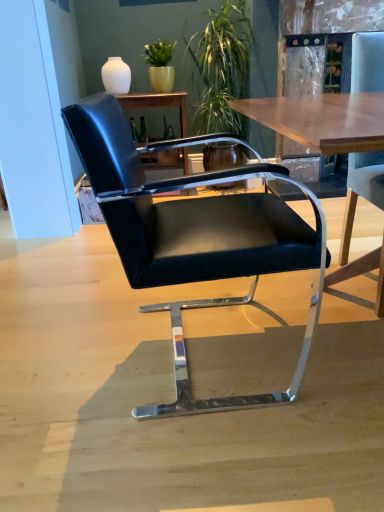
Question: Would you say black leather chair at center, the 1th chair in the left-to-right sequence, contains matte black chair at center?

Choices:
 (A) yes
 (B) no

Answer: (B)

Question: Is black leather chair at center, the 1th chair in the left-to-right sequence, not near matte black chair at center?

Choices:
 (A) no
 (B) yes

Answer: (B)

Question: From a real-world perspective, is black leather chair at center, the second chair viewed from the right, on matte black chair at center?

Choices:
 (A) no
 (B) yes

Answer: (A)

Question: From the image's perspective, does black leather chair at center, the second chair viewed from the right, appear lower than matte black chair at center?

Choices:
 (A) yes
 (B) no

Answer: (A)

Question: Is black leather chair at center, the 1th chair in the left-to-right sequence, to the right of matte black chair at center from the viewer's perspective?

Choices:
 (A) yes
 (B) no

Answer: (A)

Question: Is black leather chair at center, the second chair viewed from the right, bigger than matte black chair at center?

Choices:
 (A) yes
 (B) no

Answer: (A)

Question: From the image's perspective, is black leather chair at right, which appears as the first chair when viewed from the right, above matte black chair at center?

Choices:
 (A) yes
 (B) no

Answer: (B)

Question: Considering the relative sizes of black leather chair at right, the 2th chair when ordered from left to right, and matte black chair at center in the image provided, is black leather chair at right, the 2th chair when ordered from left to right, bigger than matte black chair at center?

Choices:
 (A) yes
 (B) no

Answer: (A)

Question: Does black leather chair at right, which appears as the first chair when viewed from the right, appear on the right side of matte black chair at center?

Choices:
 (A) no
 (B) yes

Answer: (B)

Question: From the image's perspective, does black leather chair at right, the 2th chair when ordered from left to right, appear lower than matte black chair at center?

Choices:
 (A) yes
 (B) no

Answer: (A)

Question: Could you tell me if black leather chair at right, which appears as the first chair when viewed from the right, is turned towards matte black chair at center?

Choices:
 (A) no
 (B) yes

Answer: (A)

Question: From a real-world perspective, is black leather chair at right, the 2th chair when ordered from left to right, on matte black chair at center?

Choices:
 (A) yes
 (B) no

Answer: (B)

Question: Does black leather chair at center, the 1th chair in the left-to-right sequence, turn towards black leather chair at right, the 2th chair when ordered from left to right?

Choices:
 (A) no
 (B) yes

Answer: (B)